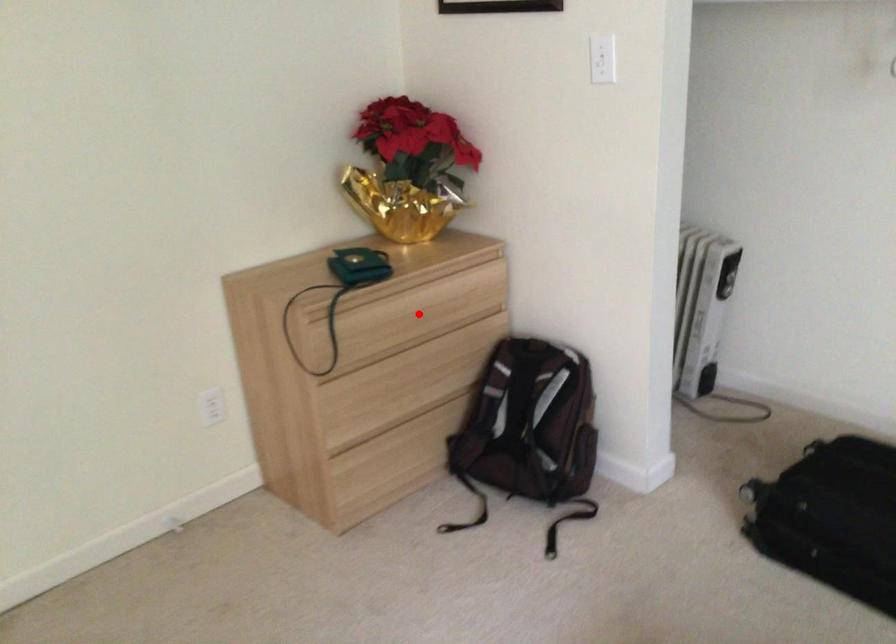
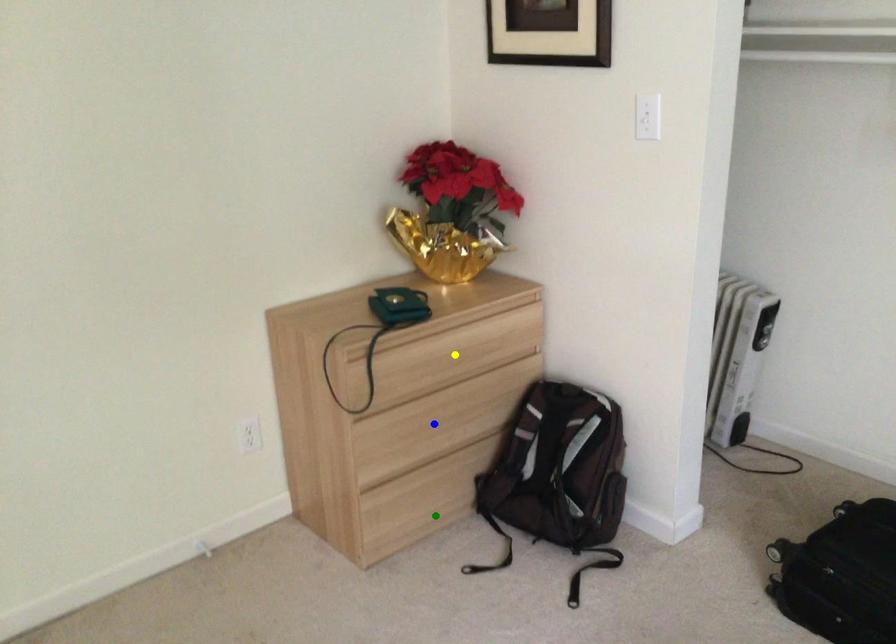
Question: I am providing you with two images of the same scene from different viewpoints. A red point is marked on the first image. You are given multiple points on the second image. Can you choose the point in image 2 that corresponds to the point in image 1?

Choices:
 (A) yellow point
 (B) blue point
 (C) green point

Answer: (A)